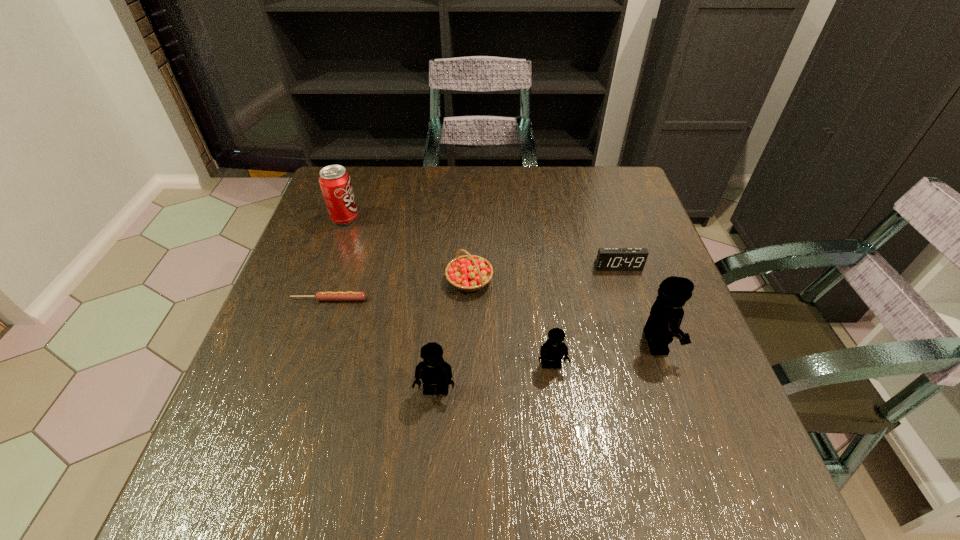
This screenshot has height=540, width=960. Find the location of `object that is the fourth closest to the soda`. object that is the fourth closest to the soda is located at coordinates (552, 351).

Identify which Lego is the nearest to the second Lego from left to right. Please provide its 2D coordinates. Your answer should be formatted as a tuple, i.e. [(x, y)], where the tuple contains the x and y coordinates of a point satisfying the conditions above.

[(433, 370)]

In order to click on Lego that is the closest to the sausage in this screenshot , I will do `click(433, 370)`.